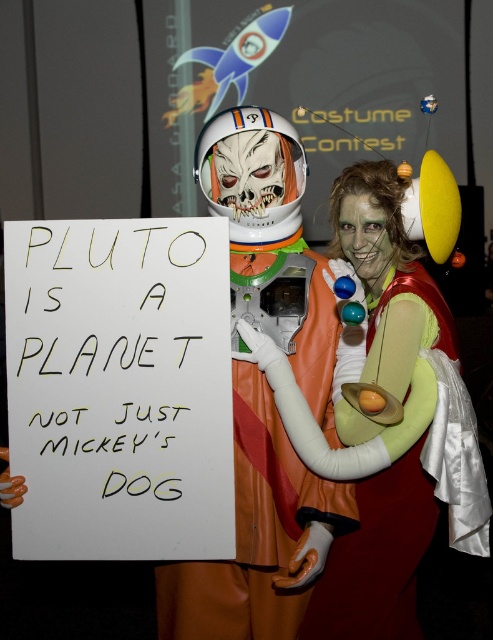
You are a photographer at the costume contest. You want to take a photo that focuses on the orange latex spacesuit at center without the green fabric dress at center blocking it. What should you do?

Move the orange latex spacesuit at center forward so that it is in front of the green fabric dress at center.

In the scene shown: You are a photographer at a costume contest. You need to arrange the green fabric dress at center and the orange latex spacesuit at center for a photo. Which one should be placed to the left to match the current scene?

The orange latex spacesuit at center should be placed to the left because the green fabric dress at center is positioned on the right side of it in the current scene.